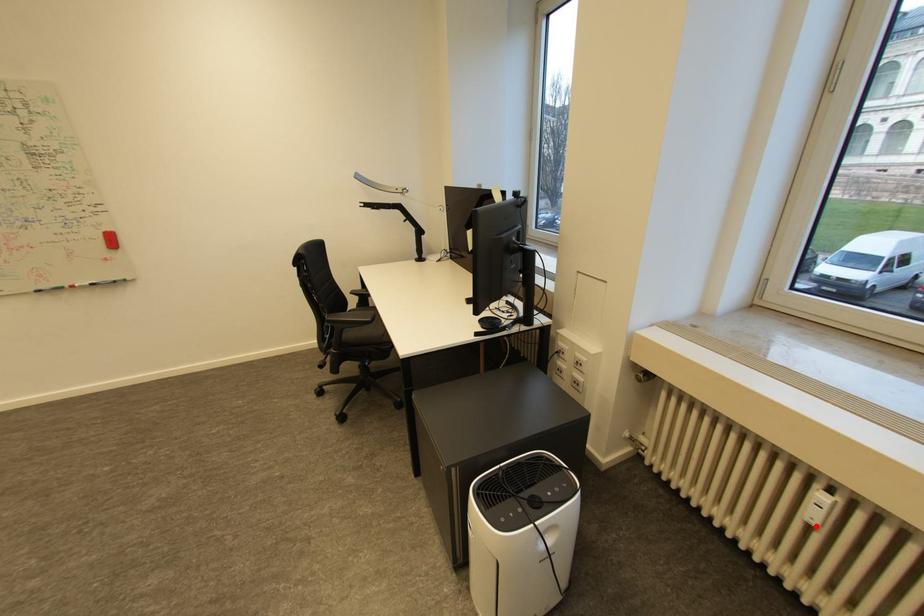
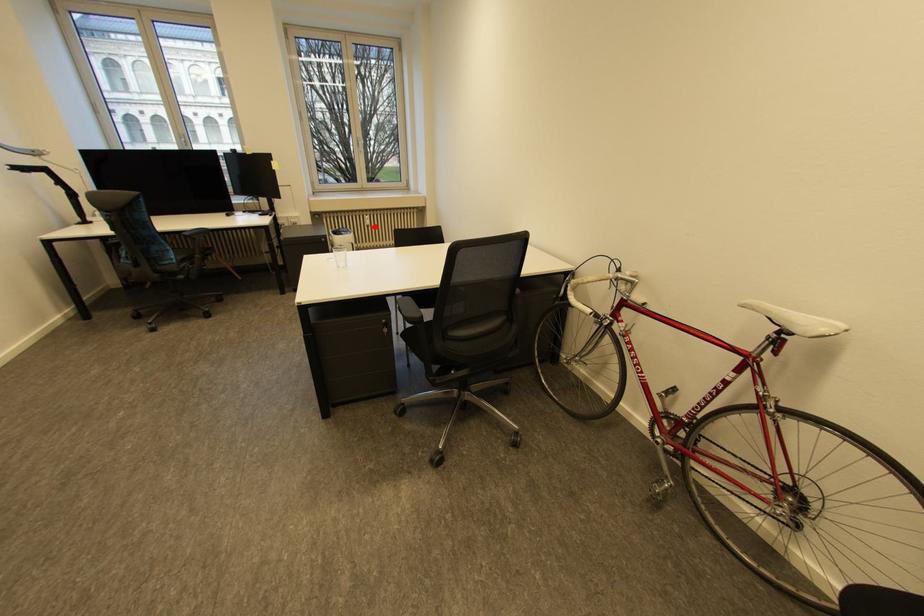
I am providing you with two images of the same scene from different viewpoints. A red point is marked on the first image and another point is marked on the second image. Do the highlighted points in image1 and image2 indicate the same real-world spot?

Yes